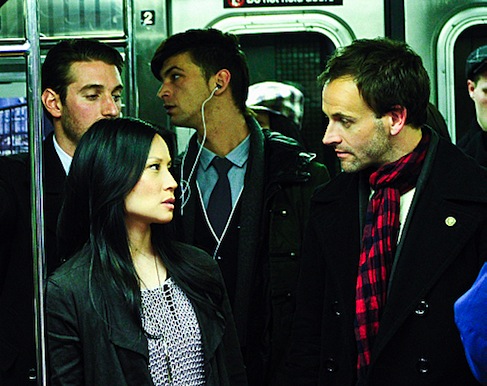
The width and height of the screenshot is (487, 386). In order to click on door in this screenshot , I will do `click(275, 72)`.